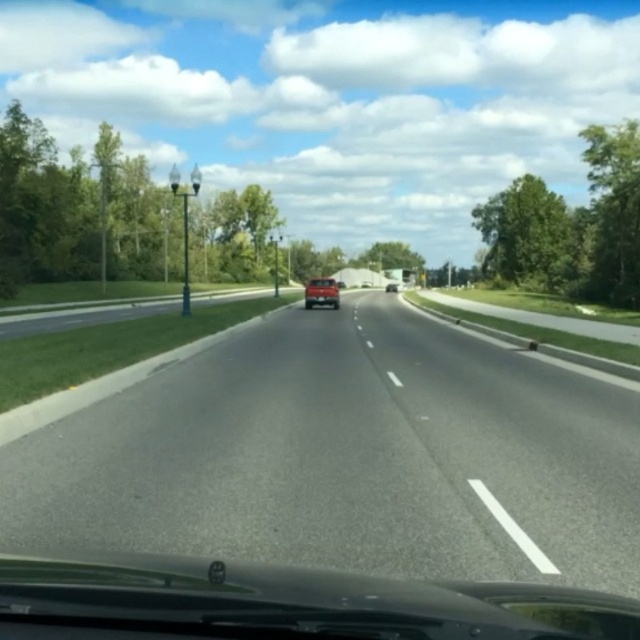
Does asphalt road at center have a greater height compared to matte black suv at center?

No.

Between point (330, 349) and point (388, 282), which one is positioned in front?

Point (330, 349)

At what (x,y) coordinates should I click in order to perform the action: click on asphalt road at center. Please return your answer as a coordinate pair (x, y). The image size is (640, 640). Looking at the image, I should click on (346, 456).

Find the location of a particular element. asphalt road at center is located at coordinates (346, 456).

Does point (224, 497) lie behind point (328, 282)?

No, it is in front of (328, 282).

Who is more distant from viewer, (577, 400) or (305, 307)?

The point (305, 307) is behind.

What do you see at coordinates (346, 456) in the screenshot?
I see `asphalt road at center` at bounding box center [346, 456].

I want to click on asphalt road at center, so pos(346,456).

Is shiny red car at center to the right of matte black suv at center from the viewer's perspective?

Incorrect, shiny red car at center is not on the right side of matte black suv at center.

Does point (317, 304) come farther from viewer compared to point (397, 284)?

No, (317, 304) is in front of (397, 284).

The width and height of the screenshot is (640, 640). In order to click on shiny red car at center in this screenshot , I will do `click(321, 292)`.